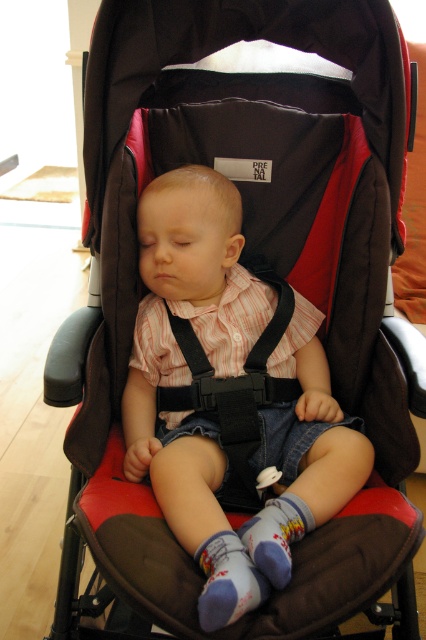
Question: Which point is farther from the camera taking this photo?

Choices:
 (A) (215, 476)
 (B) (166, 404)

Answer: (B)

Question: Is matte pink shirt at center smaller than black fabric strap at center?

Choices:
 (A) no
 (B) yes

Answer: (A)

Question: Which of the following is the closest to the observer?

Choices:
 (A) matte pink shirt at center
 (B) printed cotton sock at center

Answer: (A)

Question: Which point appears closest to the camera in this image?

Choices:
 (A) (207, 570)
 (B) (233, 461)

Answer: (A)

Question: Is black fabric strap at center above printed cotton sock at center?

Choices:
 (A) yes
 (B) no

Answer: (A)

Question: Can you confirm if black fabric strap at center is positioned to the left of printed cotton sock at center?

Choices:
 (A) no
 (B) yes

Answer: (B)